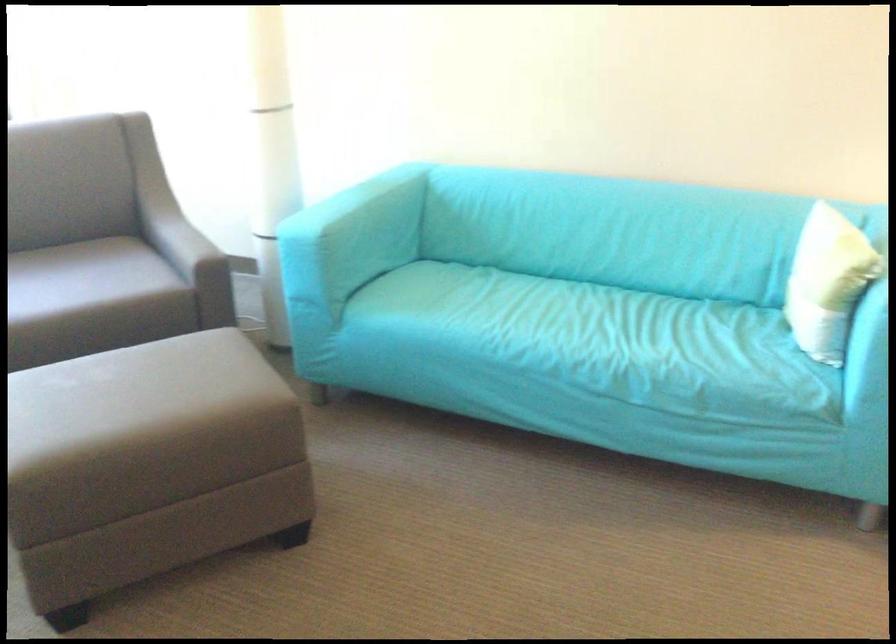
The image size is (896, 644). In order to click on chair armrest in this screenshot , I will do `click(188, 251)`.